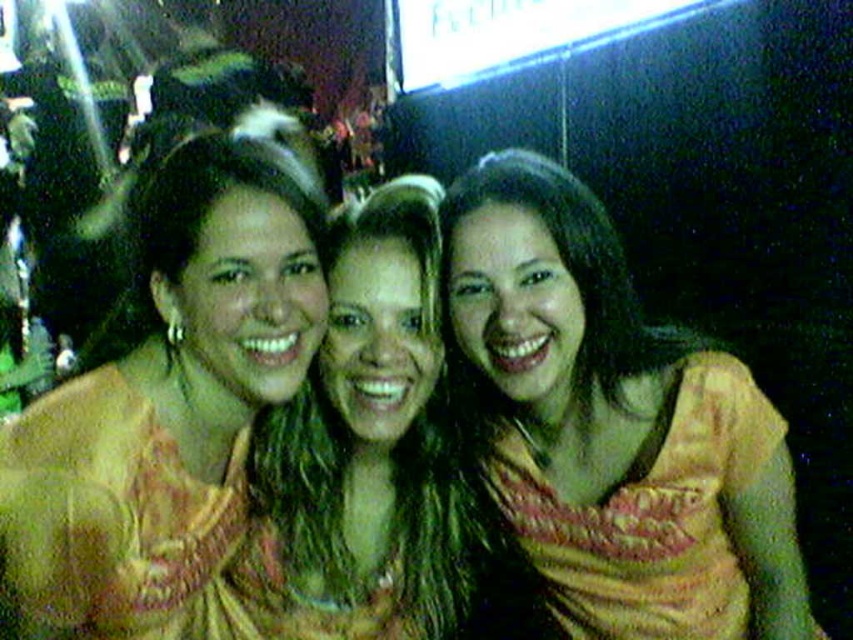
Does yellow-orange fabric at center have a greater height compared to matte yellow blouse at center?

Indeed, yellow-orange fabric at center has a greater height compared to matte yellow blouse at center.

Does point (578, 212) lie in front of point (184, 188)?

No, (578, 212) is further to viewer.

You are a GUI agent. You are given a task and a screenshot of the screen. Output one action in this format:
    pyautogui.click(x=<x>, y=<y>)
    Task: Click on the yellow-orange fabric at center
    
    Given the screenshot: What is the action you would take?
    pos(614,424)